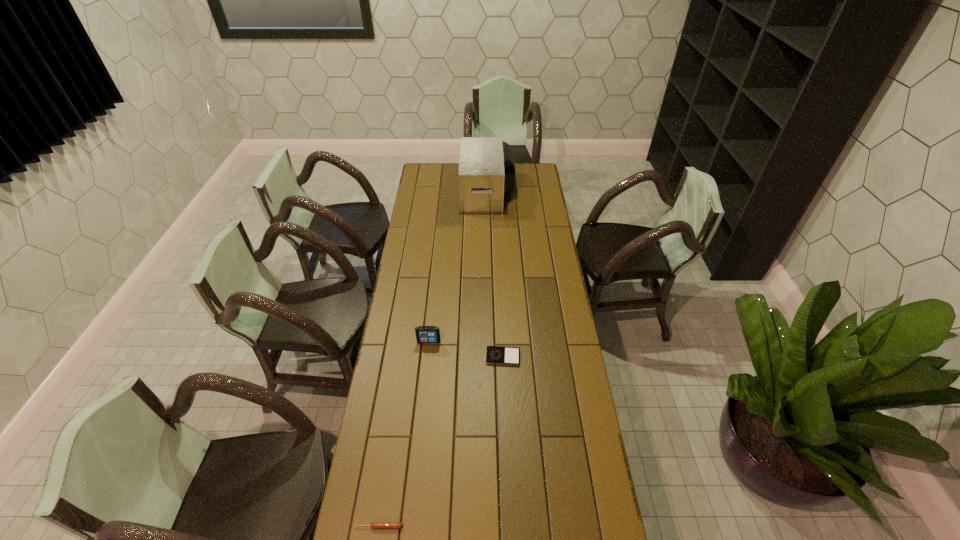
Where is `vacant area between the farthest object and the second farthest object`? The height and width of the screenshot is (540, 960). vacant area between the farthest object and the second farthest object is located at coordinates (458, 267).

In order to click on object that is the second closest to the sausage in this screenshot , I will do `click(424, 334)`.

Locate an element on the screen. the second closest object to the nearer iPod is located at coordinates [x=374, y=525].

You are a GUI agent. You are given a task and a screenshot of the screen. Output one action in this format:
    pyautogui.click(x=<x>, y=<y>)
    Task: Click on the vacant space that satisfies the following two spatial constraints: 1. on the front screen of the left iPod; 2. on the left side of the nearer iPod
    
    Given the screenshot: What is the action you would take?
    point(427,357)

Find the location of a particular element. blank space that satisfies the following two spatial constraints: 1. on the front-facing side of the right iPod; 2. on the right side of the microwave oven is located at coordinates pos(491,357).

Identify the location of vacant area that satisfies the following two spatial constraints: 1. on the front-facing side of the microwave oven; 2. on the front screen of the taller iPod. (490, 342).

Identify the location of free space that satisfies the following two spatial constraints: 1. on the front screen of the shortest object; 2. on the right side of the farther iPod. The image size is (960, 540). [x=427, y=357].

At what (x,y) coordinates should I click in order to perform the action: click on free space that satisfies the following two spatial constraints: 1. on the front-facing side of the microwave oven; 2. on the front screen of the left iPod. Please return your answer as a coordinate pair (x, y). Looking at the image, I should click on (490, 342).

At what (x,y) coordinates should I click in order to perform the action: click on free spot that satisfies the following two spatial constraints: 1. on the front-facing side of the tallest object; 2. on the front side of the nearest object. Please return your answer as a coordinate pair (x, y). Looking at the image, I should click on (493, 526).

Find the location of a particular element. The height and width of the screenshot is (540, 960). free space that satisfies the following two spatial constraints: 1. on the front screen of the farther iPod; 2. on the left side of the shortest object is located at coordinates (427, 357).